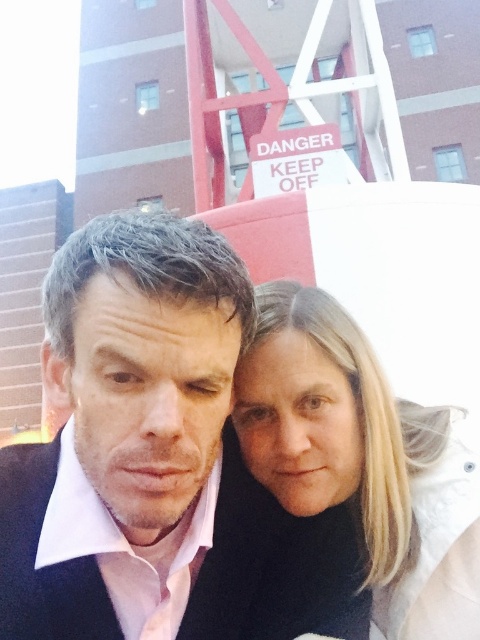
From the picture: You are a photographer trying to adjust the lighting for a photo shoot. You notice the pink matte shirt at center and the black matte business suit at center in the frame. Which of these two items is positioned to the right side of the other?

The pink matte shirt at center is positioned to the right of the black matte business suit at center.

You are taking a selfie with two friends in front of a danger zone sign. You notice two points marked on the ground at coordinates point (283, 314) and point (290, 572). According to the scene, which point is farther away from the danger sign?

Point (283, 314) is behind point (290, 572), so it is farther away from the danger sign.